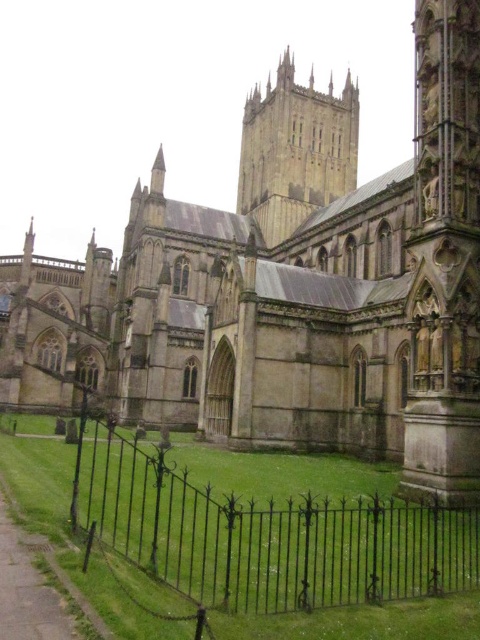
Question: Does black wrought iron fence at lower center appear under stone tower at center?

Choices:
 (A) yes
 (B) no

Answer: (A)

Question: In this image, where is black wrought iron fence at lower center located relative to stone tower at center?

Choices:
 (A) left
 (B) right

Answer: (A)

Question: Which object appears closest to the camera in this image?

Choices:
 (A) black wrought iron fence at lower center
 (B) stone tower at center

Answer: (A)

Question: Among these points, which one is farthest from the camera?

Choices:
 (A) (291, 193)
 (B) (448, 561)

Answer: (A)

Question: Is black wrought iron fence at lower center thinner than stone tower at center?

Choices:
 (A) yes
 (B) no

Answer: (B)